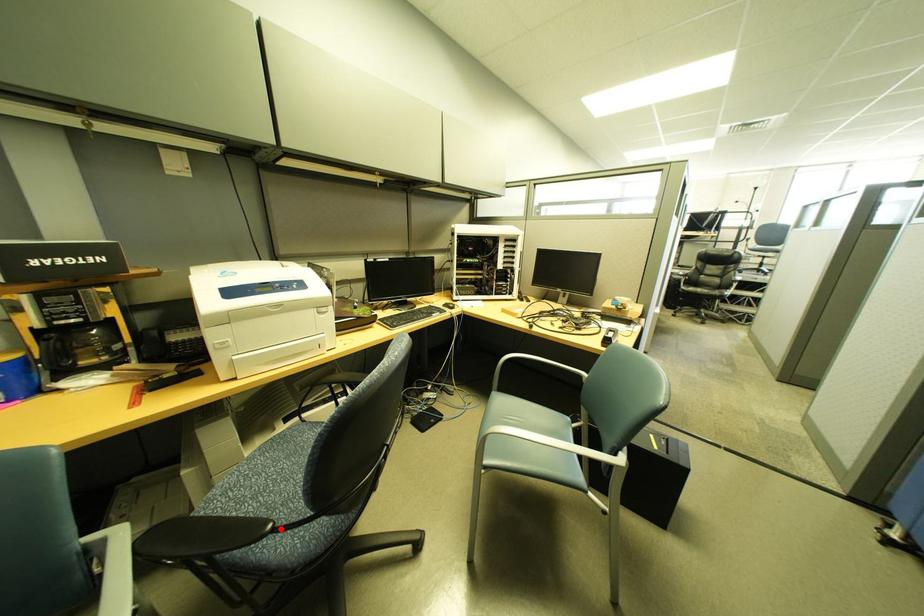
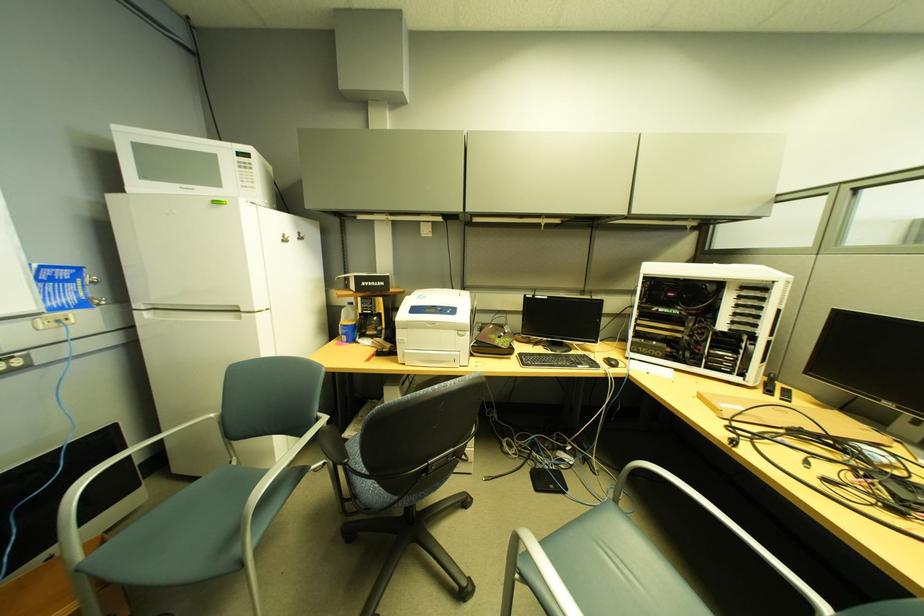
Question: I am providing you with two images of the same scene from different viewpoints. A red point is marked on the first image. At the location where the point appears in image 1, is it still visible in image 2?

Choices:
 (A) Yes
 (B) No

Answer: (A)